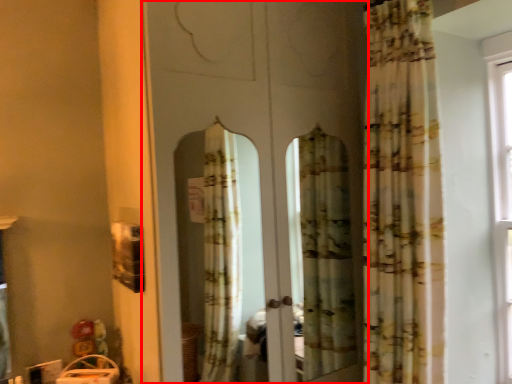
Question: Where is screen door (annotated by the red box) located in relation to curtain in the image?

Choices:
 (A) right
 (B) left

Answer: (B)